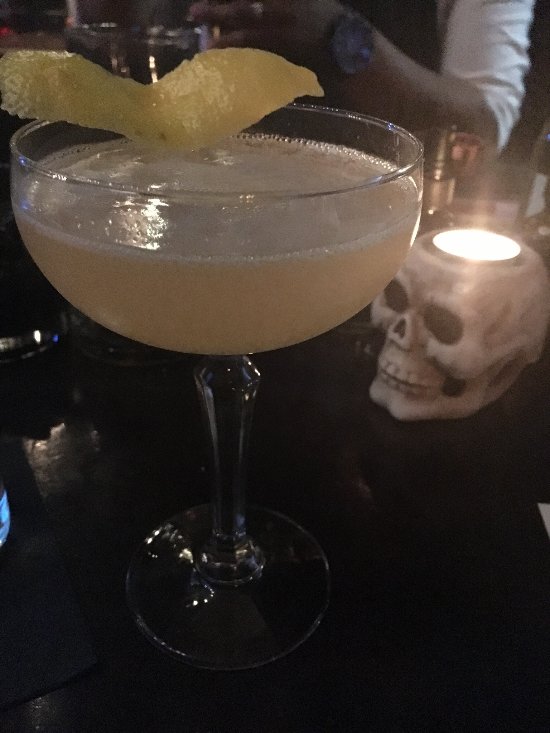
Where is `candle flame`? candle flame is located at coordinates click(480, 246).